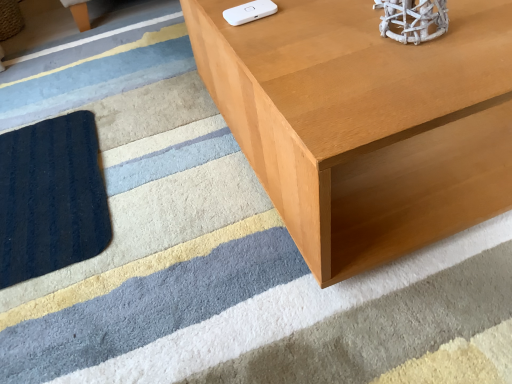
Identify the location of vacant space in front of white matte wii controller at upper center. click(286, 45).